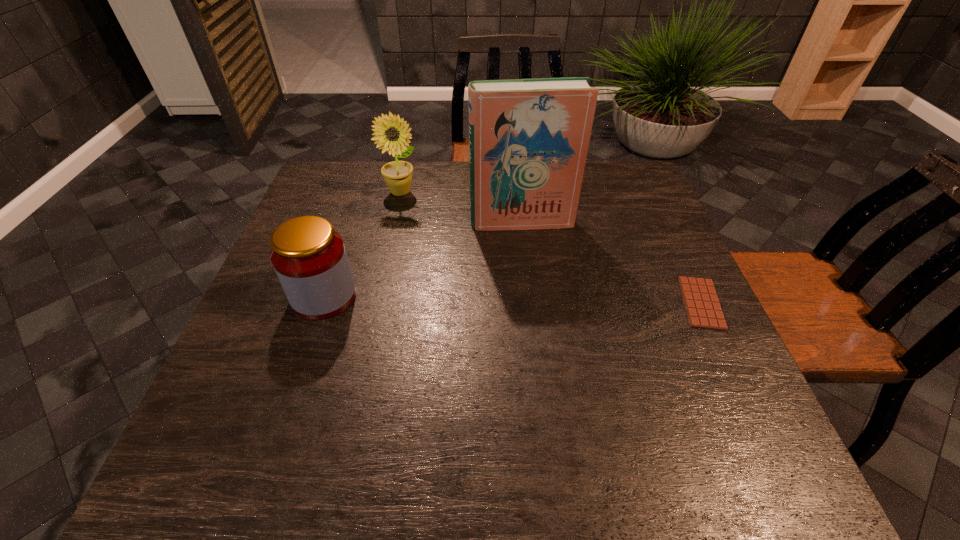
You are a GUI agent. You are given a task and a screenshot of the screen. Output one action in this format:
    pyautogui.click(x=<x>, y=<y>)
    Task: Click on the jar
    This screenshot has width=960, height=540.
    Given the screenshot: What is the action you would take?
    pyautogui.click(x=309, y=257)

Where is `the shortest object`? the shortest object is located at coordinates (703, 309).

Find the location of a particular element. the rightmost object is located at coordinates (703, 309).

The height and width of the screenshot is (540, 960). Identify the location of the farthest object. (392, 133).

The width and height of the screenshot is (960, 540). Find the location of `sunflower`. sunflower is located at coordinates pos(392,133).

Locate an element on the screen. The width and height of the screenshot is (960, 540). the tallest object is located at coordinates (528, 138).

Identify the location of the third nearest object. The image size is (960, 540). (528, 138).

At what (x,y) coordinates should I click in order to perform the action: click on vacant space located on the back of the jar. Please return your answer as a coordinate pair (x, y). Image resolution: width=960 pixels, height=540 pixels. Looking at the image, I should click on (361, 188).

Find the location of a particular element. This screenshot has height=540, width=960. blank space located on the left of the rightmost object is located at coordinates (636, 303).

You are a GUI agent. You are given a task and a screenshot of the screen. Output one action in this format:
    pyautogui.click(x=<x>, y=<y>)
    Task: Click on the vacant position located on the face of the farthest object
    The image size is (960, 540).
    Given the screenshot: What is the action you would take?
    pyautogui.click(x=430, y=223)